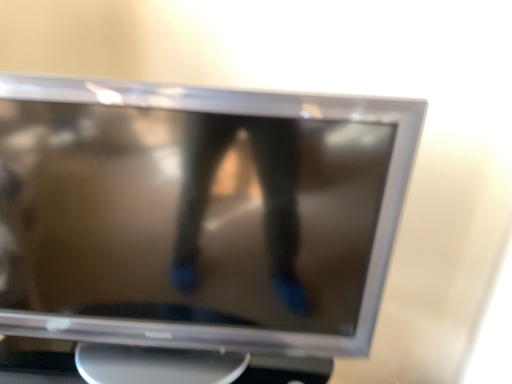
What do you see at coordinates (193, 227) in the screenshot?
I see `satin silver monitor at center` at bounding box center [193, 227].

Find the location of a particular element. The height and width of the screenshot is (384, 512). satin silver monitor at center is located at coordinates (193, 227).

Find the location of a particular element. satin silver monitor at center is located at coordinates (193, 227).